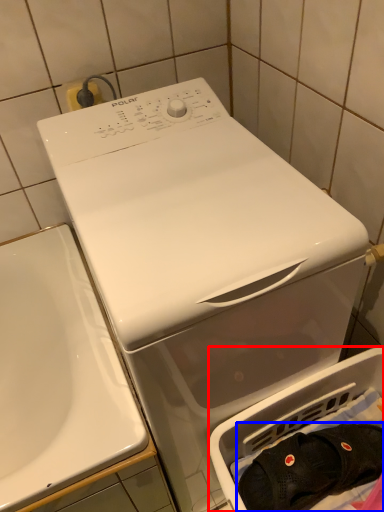
Question: Which point is closer to the camera, dish washer (highlighted by a red box) or clothing (highlighted by a blue box)?

Choices:
 (A) dish washer
 (B) clothing

Answer: (A)